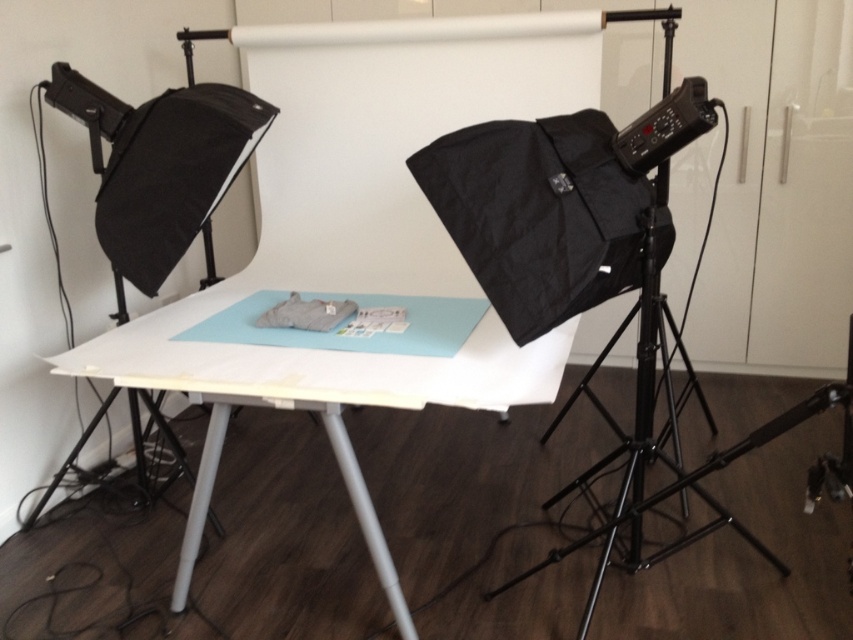
You are setting up a camera for a product shoot and need to position it so it faces both the white matte table at center and the black plastic light at upper right. Which side should you stand on to ensure both objects are in your view?

You should stand to the right side of the white matte table at center and black plastic light at upper right to ensure both are in view, as the white matte table at center is to the left of the black plastic light at upper right.

You are setting up a camera on the black metal tripod at right to photograph the gray fabric item on the white matte table at center. Since the table is shorter than the tripod, will you need to adjust the height of the tripod to get a better angle?

The white matte table at center is shorter than the black metal tripod at right. To get a better angle, you may need to lower the height of the black metal tripod at right so that the camera can capture the gray fabric item on the white matte table at center properly.

You are setting up a camera on a tripod to take a photo of the gray fabric item. The camera is heavy and might tip over if placed on an unstable surface. Which object, the white matte table at center or the black metal tripod at right, should you place the camera on to ensure stability?

The white matte table at center is above the black metal tripod at right, so placing the camera on the white matte table at center would provide a more stable and level surface compared to the tripod.